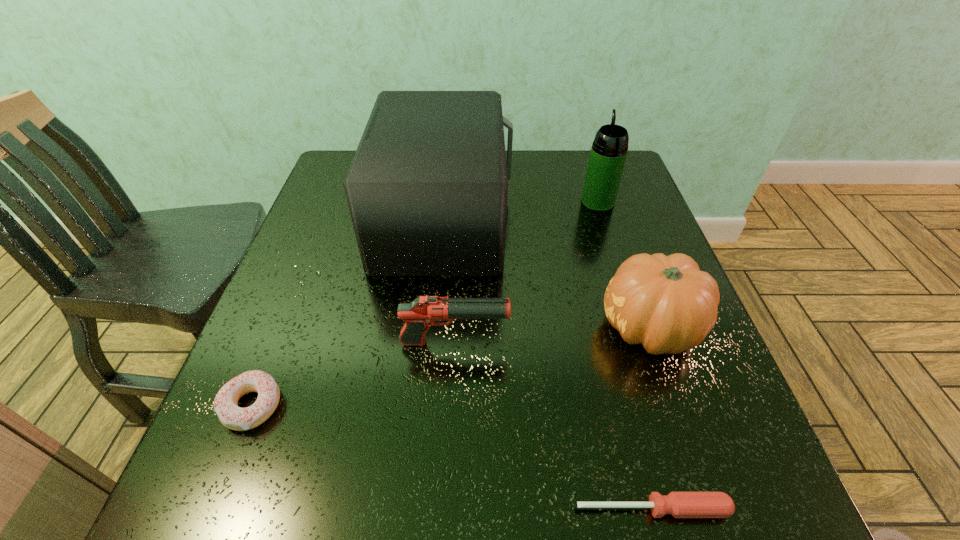
I want to click on microwave oven, so click(x=427, y=189).

Image resolution: width=960 pixels, height=540 pixels. What are the coordinates of `thermos bottle` in the screenshot? It's located at (608, 154).

You are a GUI agent. You are given a task and a screenshot of the screen. Output one action in this format:
    pyautogui.click(x=<x>, y=<y>)
    Task: Click on the third tallest object
    Image resolution: width=960 pixels, height=540 pixels.
    Given the screenshot: What is the action you would take?
    pyautogui.click(x=666, y=303)

Locate an element on the screen. The image size is (960, 540). the fourth tallest object is located at coordinates (424, 311).

Where is `the leftmost object`? the leftmost object is located at coordinates [233, 417].

Where is `the second shortest object`? The image size is (960, 540). the second shortest object is located at coordinates (233, 417).

Locate an element on the screen. The width and height of the screenshot is (960, 540). screwdriver is located at coordinates (679, 504).

I want to click on the nearest object, so click(x=679, y=504).

The width and height of the screenshot is (960, 540). Find the location of `blank space located on the front-facing side of the microwave oven`. blank space located on the front-facing side of the microwave oven is located at coordinates (621, 218).

The height and width of the screenshot is (540, 960). In order to click on free region located from the spout of the thermos bottle in this screenshot , I will do `click(588, 172)`.